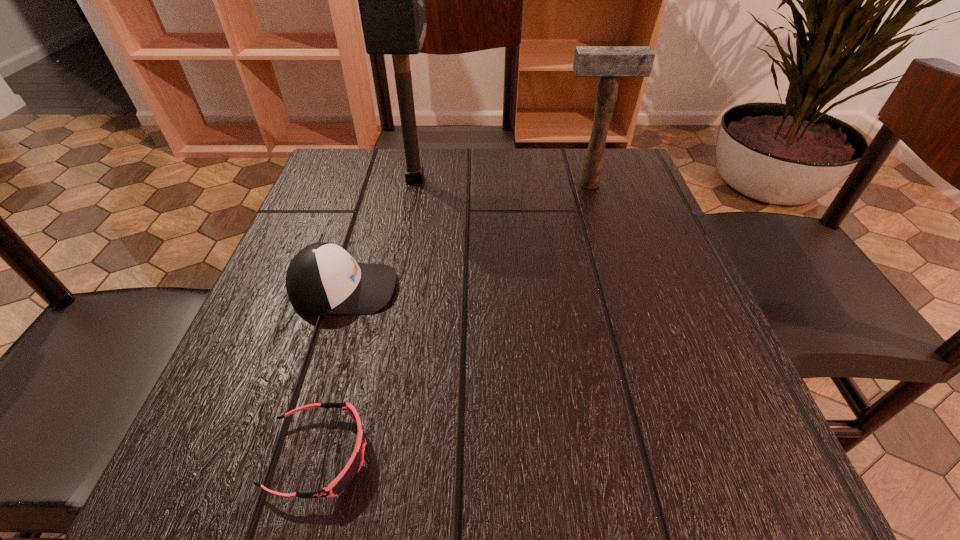
In the image, there is a desktop. At what (x,y) coordinates should I click in order to perform the action: click on vacant space at the left edge. Please return your answer as a coordinate pair (x, y). Looking at the image, I should click on (300, 318).

Locate an element on the screen. free location at the right edge is located at coordinates (637, 252).

Locate an element on the screen. free space at the near left corner is located at coordinates (250, 468).

The image size is (960, 540). Find the location of `vacant space at the far right corner`. vacant space at the far right corner is located at coordinates (639, 184).

This screenshot has width=960, height=540. What are the coordinates of `free space at the near right corner of the desktop` in the screenshot? It's located at (770, 460).

Locate an element on the screen. The height and width of the screenshot is (540, 960). vacant space that is in between the taller mallet and the shorter mallet is located at coordinates (502, 181).

The height and width of the screenshot is (540, 960). Find the location of `unoccupied position between the second tallest object and the nearest object`. unoccupied position between the second tallest object and the nearest object is located at coordinates (454, 320).

Identify the location of free space between the rightmost object and the left mallet. The width and height of the screenshot is (960, 540). (502, 181).

This screenshot has height=540, width=960. I want to click on free point between the right mallet and the tallest object, so click(502, 181).

This screenshot has height=540, width=960. Identify the location of free point between the right mallet and the taller mallet. (502, 181).